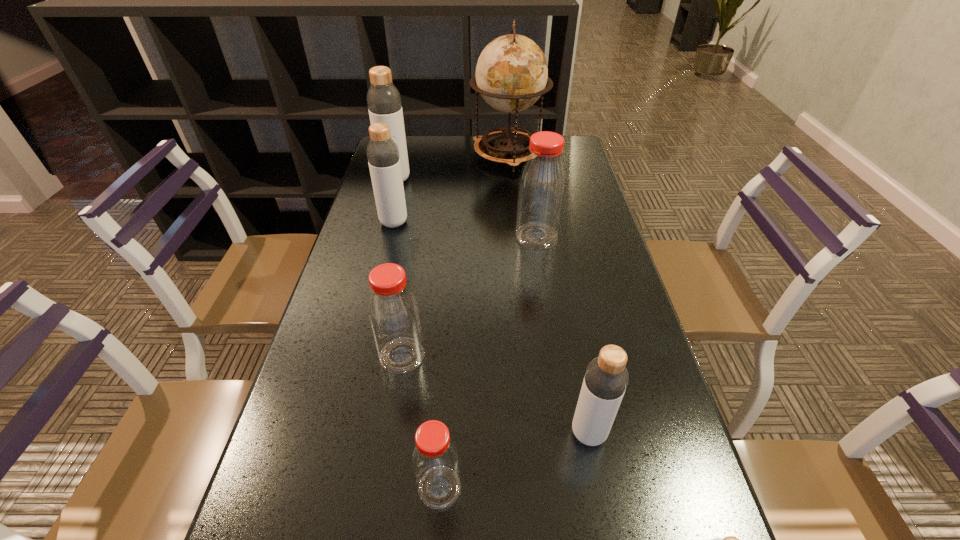
I want to click on globe that is at the right edge, so click(511, 74).

The width and height of the screenshot is (960, 540). I want to click on object located at the far right corner, so click(511, 74).

I want to click on vacant space at the far edge of the desktop, so click(510, 165).

Find the location of `vacant space at the left edge of the desktop`. vacant space at the left edge of the desktop is located at coordinates (371, 198).

Where is `vacant space at the right edge`? Image resolution: width=960 pixels, height=540 pixels. vacant space at the right edge is located at coordinates (586, 287).

Identify the location of vacant space at the far right corner of the desktop. (578, 140).

The image size is (960, 540). I want to click on unoccupied position between the fourth farthest bottle and the second nearest object, so click(420, 422).

At what (x,y) coordinates should I click in order to perform the action: click on free space between the seventh shortest object and the globe. Please return your answer as a coordinate pair (x, y). Looking at the image, I should click on (452, 167).

This screenshot has height=540, width=960. I want to click on blank region between the seventh farthest object and the farthest red bottle, so click(x=489, y=362).

Locate which object ranks in proximity to the third nearest gray bottle. Please provide its 2D coordinates. Your answer should be formatted as a tuple, i.e. [(x, y)], where the tuple contains the x and y coordinates of a point satisfying the conditions above.

[(384, 103)]